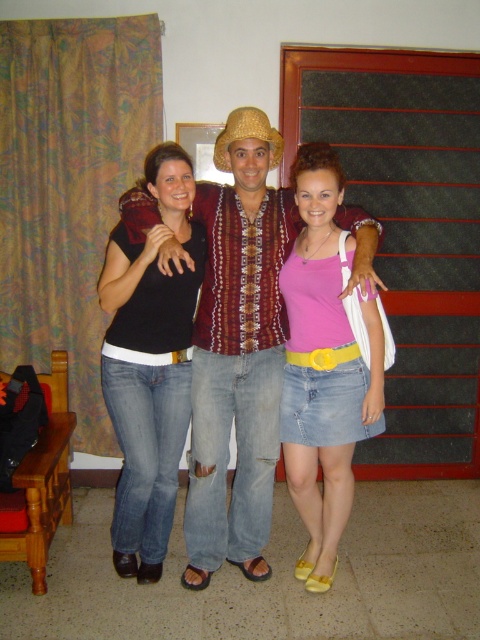
The height and width of the screenshot is (640, 480). What do you see at coordinates (238, 364) in the screenshot? I see `patterned fabric shirt at center` at bounding box center [238, 364].

Consider the image. Which is above, patterned fabric shirt at center or golden straw cowboy hat at center?

Positioned higher is golden straw cowboy hat at center.

Find the location of `patterned fabric shirt at center`. patterned fabric shirt at center is located at coordinates (238, 364).

Is pink denim skirt at center taller than golden straw cowboy hat at center?

Correct, pink denim skirt at center is much taller as golden straw cowboy hat at center.

Which is behind, point (305, 296) or point (272, 141)?

The point (305, 296) is more distant.

The width and height of the screenshot is (480, 640). What are the coordinates of `pink denim skirt at center` in the screenshot? It's located at (324, 365).

Who is positioned more to the left, black matte t-shirt at center or golden straw cowboy hat at center?

black matte t-shirt at center

Is point (169, 211) farther from viewer compared to point (242, 128)?

Yes.

The height and width of the screenshot is (640, 480). I want to click on black matte t-shirt at center, so click(149, 364).